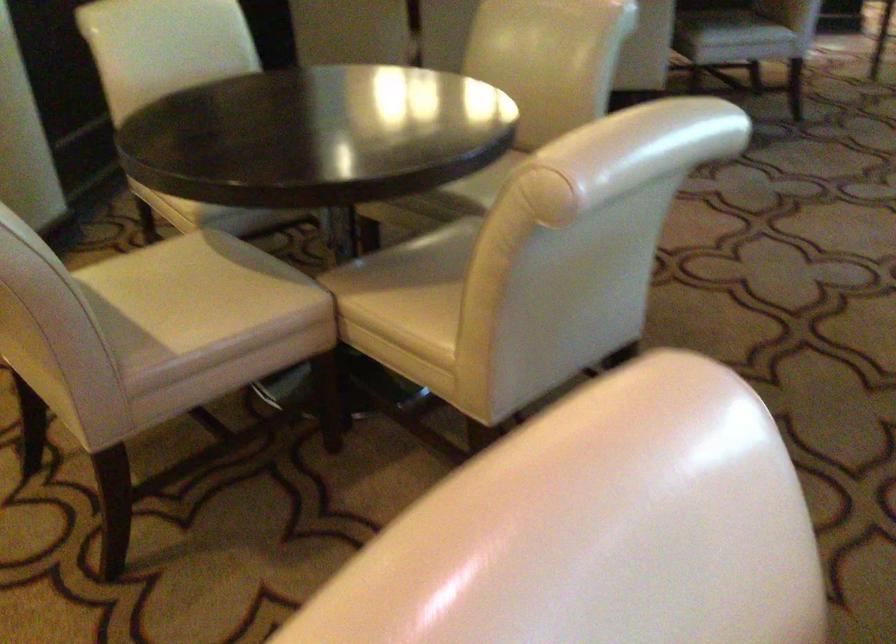
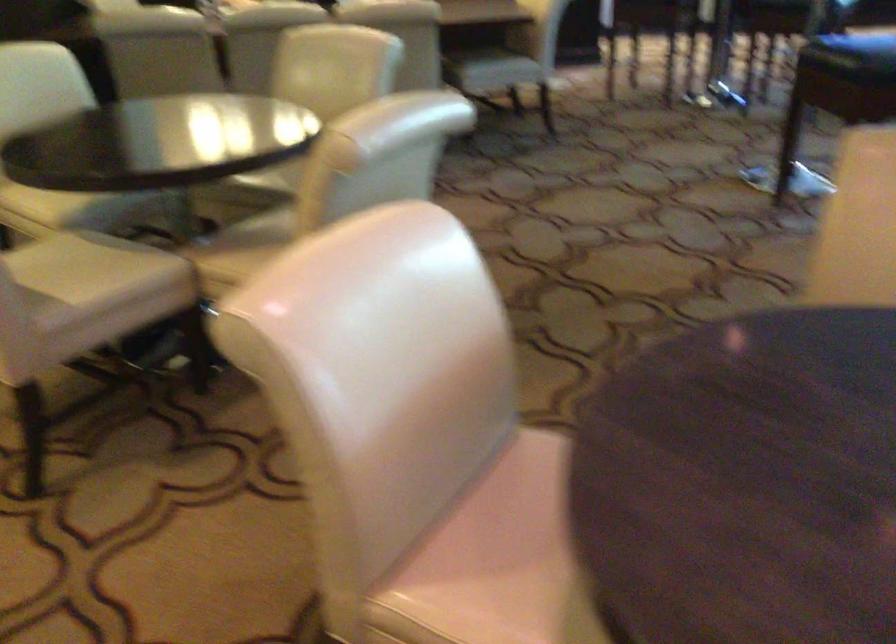
Locate, in the second image, the point that corresponds to the point at 419,263 in the first image.

(259, 234)